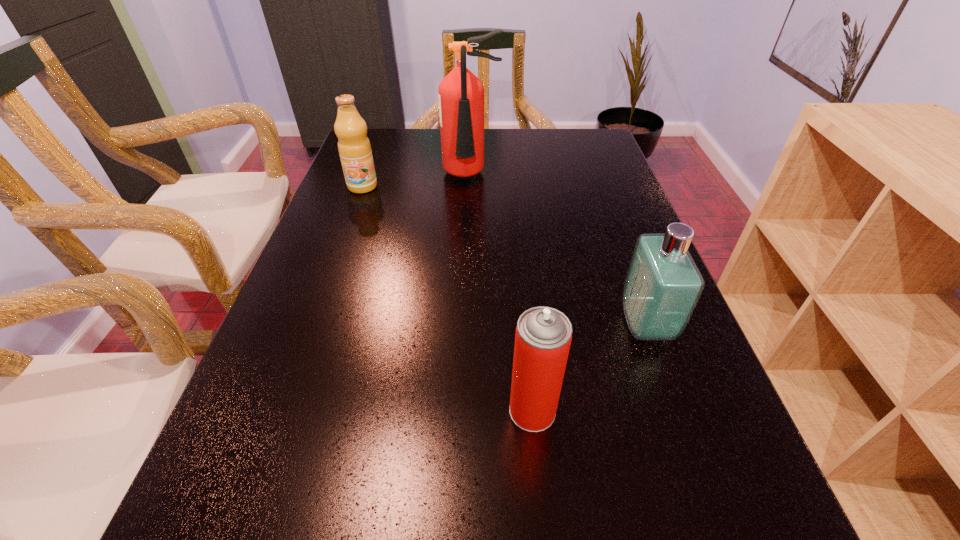
Locate an element on the screen. vacant space located on the front label of the third farthest object is located at coordinates (527, 325).

At what (x,y) coordinates should I click in order to perform the action: click on object that is at the far edge. Please return your answer as a coordinate pair (x, y). The image size is (960, 540). Looking at the image, I should click on (461, 94).

Locate an element on the screen. This screenshot has width=960, height=540. object that is positioned at the left edge is located at coordinates (354, 147).

This screenshot has height=540, width=960. I want to click on object that is at the right edge, so click(663, 284).

You are a GUI agent. You are given a task and a screenshot of the screen. Output one action in this format:
    pyautogui.click(x=<x>, y=<y>)
    Task: Click on the vacant space at the far edge of the desktop
    The height and width of the screenshot is (540, 960).
    Given the screenshot: What is the action you would take?
    pyautogui.click(x=429, y=149)

At what (x,y) coordinates should I click in order to perform the action: click on vacant area at the left edge. Please return your answer as a coordinate pair (x, y). The image size is (960, 540). Looking at the image, I should click on (336, 220).

Where is `vacant space at the right edge`? This screenshot has height=540, width=960. vacant space at the right edge is located at coordinates point(606,337).

This screenshot has height=540, width=960. What are the coordinates of `free space at the far left corner of the desktop` in the screenshot? It's located at (374, 153).

Identify the location of vacant area at the far right corner. (611, 164).

Where is `vacant area that lies between the leftmost object and the fire extinguisher`? vacant area that lies between the leftmost object and the fire extinguisher is located at coordinates (417, 181).